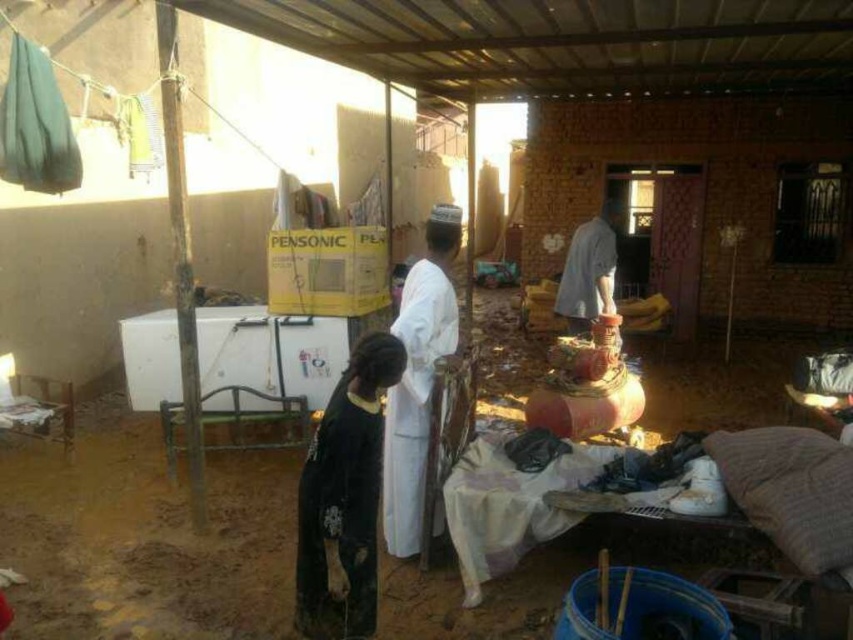
Question: Can you confirm if black matte robe at lower left is bigger than white matte robe at center?

Choices:
 (A) yes
 (B) no

Answer: (B)

Question: Among these points, which one is nearest to the camera?

Choices:
 (A) (366, 412)
 (B) (392, 468)
 (C) (585, 305)

Answer: (A)

Question: Is black matte robe at lower left to the left of white matte robe at center from the viewer's perspective?

Choices:
 (A) yes
 (B) no

Answer: (A)

Question: Based on their relative distances, which object is nearer to the dark gray fabric shirt at center right?

Choices:
 (A) white matte robe at center
 (B) black matte robe at lower left

Answer: (A)

Question: Which point is farther to the camera?

Choices:
 (A) (602, 236)
 (B) (444, 333)

Answer: (A)

Question: Is black matte robe at lower left wider than white matte robe at center?

Choices:
 (A) yes
 (B) no

Answer: (B)